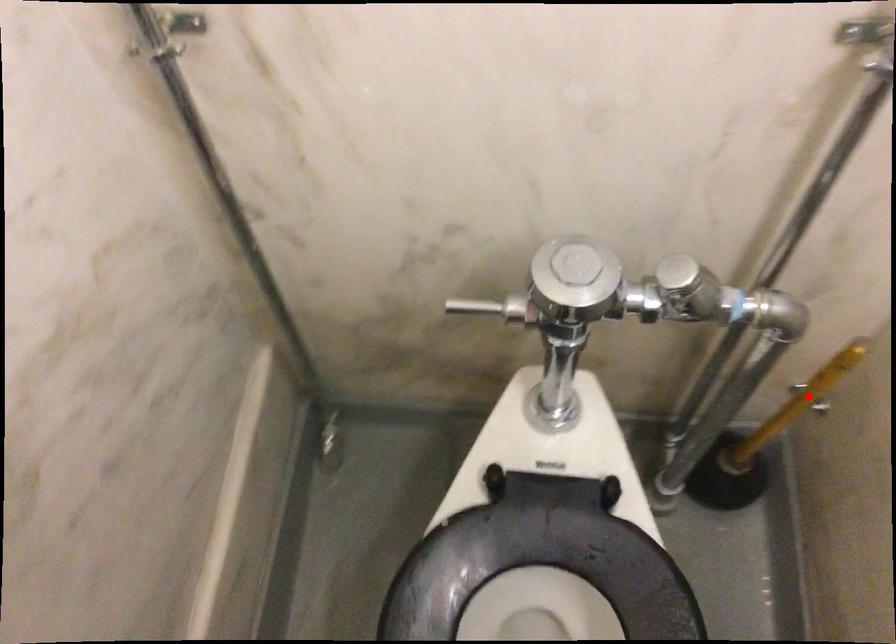
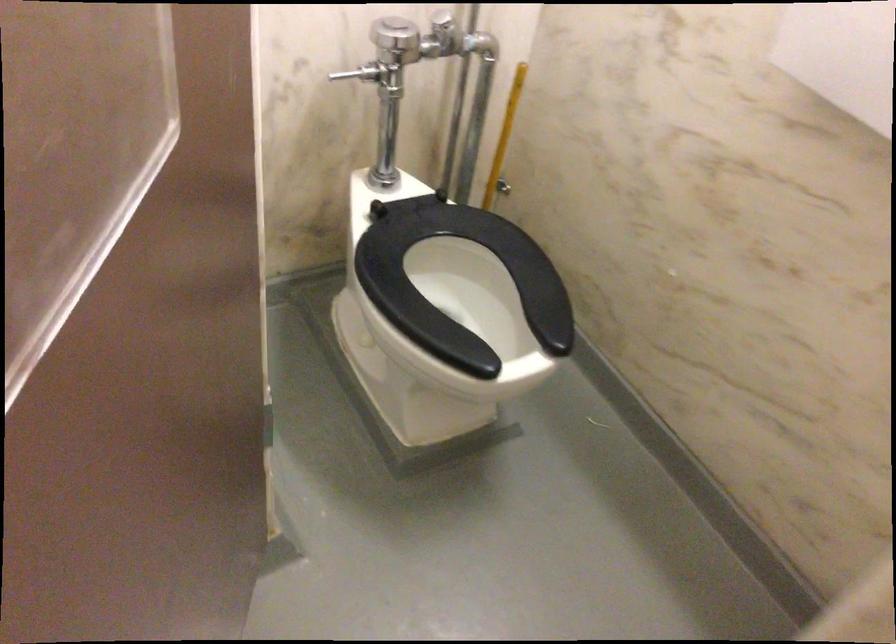
The point at the highlighted location is marked in the first image. Where is the corresponding point in the second image?

(504, 137)